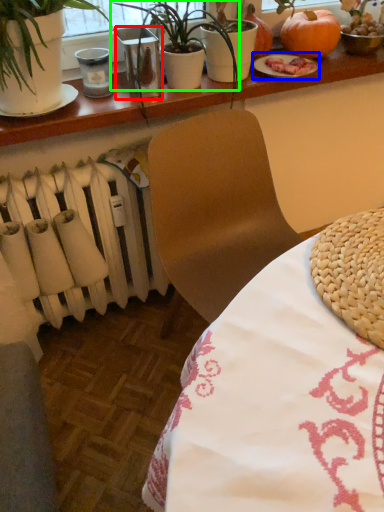
Question: Based on their relative distances, which object is farther from glass vase (highlighted by a red box)? Choose from tableware (highlighted by a blue box) and houseplant (highlighted by a green box).

Choices:
 (A) tableware
 (B) houseplant

Answer: (A)